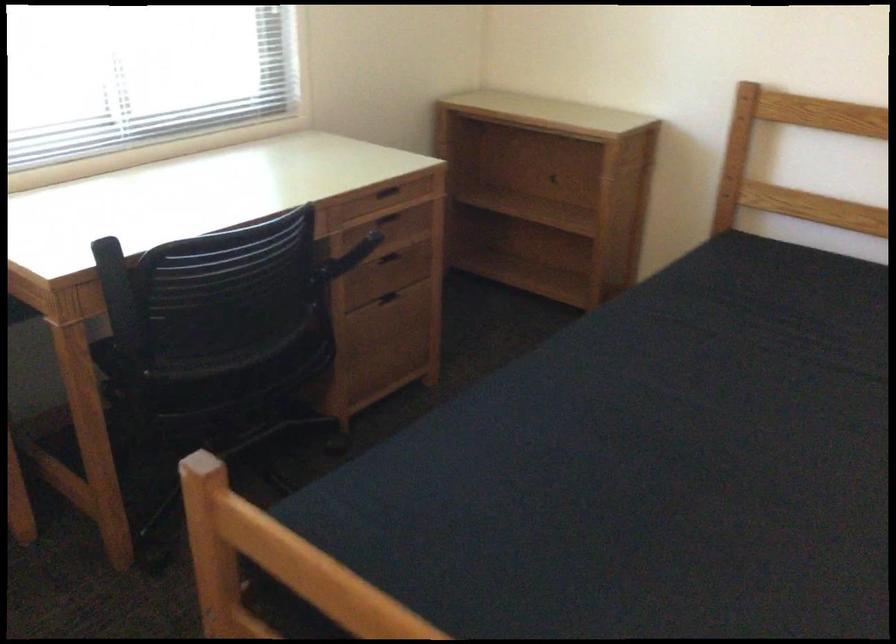
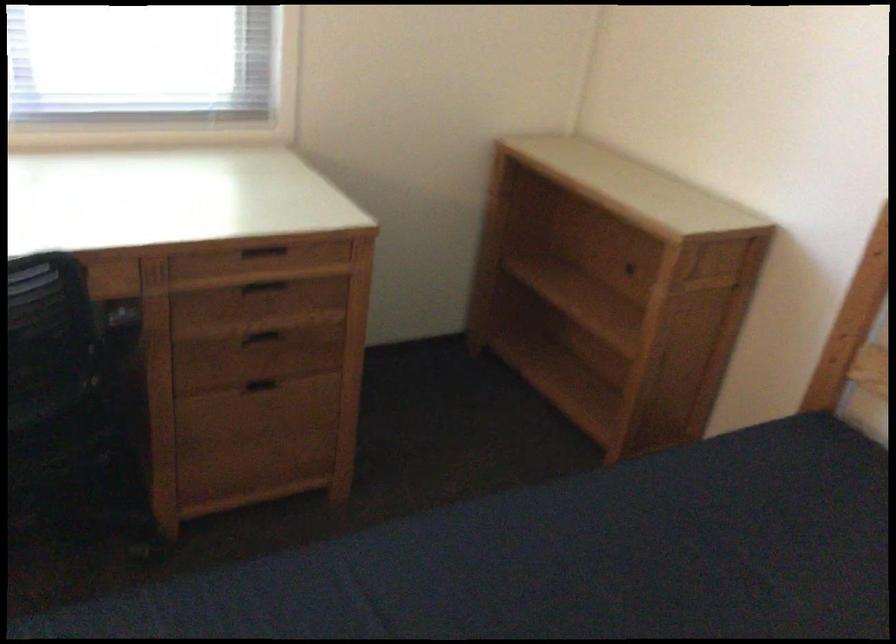
Locate, in the second image, the point that corresponds to pixel 392 218 in the first image.

(263, 285)